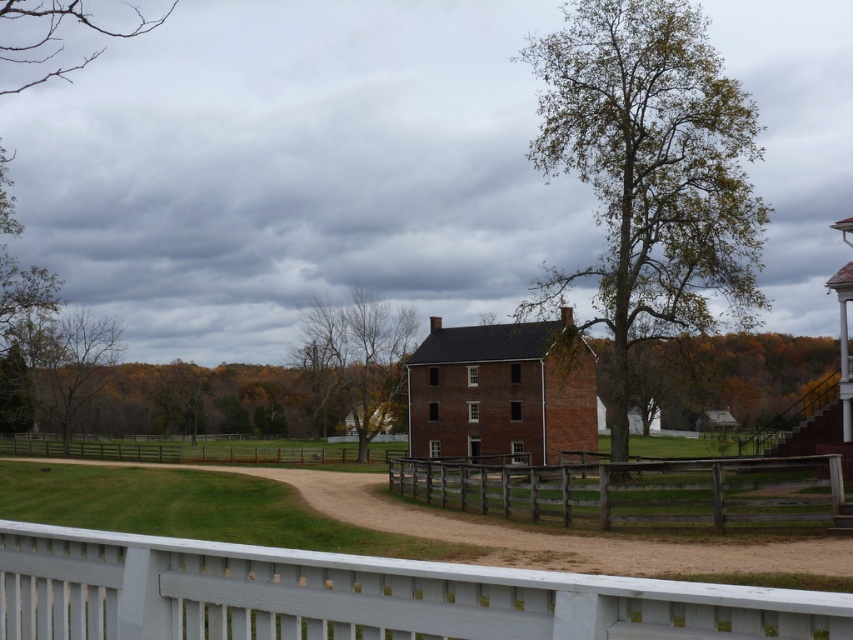
Question: Is the position of green leafy tree at center-right more distant than that of bare branches at upper left?

Choices:
 (A) yes
 (B) no

Answer: (A)

Question: Estimate the real-world distances between objects in this image. Which object is closer to the wooden planks at lower center?

Choices:
 (A) green leafy tree at center-right
 (B) bare branches at upper left
 (C) brown dirt track at center

Answer: (C)

Question: In this image, where is wooden planks at lower center located relative to green leafy tree at center-right?

Choices:
 (A) left
 (B) right

Answer: (A)

Question: Which of these objects is positioned farthest from the brown leafy tree at left?

Choices:
 (A) green leafy tree at center-right
 (B) brown leafy tree at center
 (C) brown dirt track at center

Answer: (C)

Question: Which object appears closest to the camera in this image?

Choices:
 (A) green leafy tree at center
 (B) wooden planks at lower center
 (C) brown leafy tree at left

Answer: (B)

Question: Is brown dirt track at center wider than brown leafy tree at center?

Choices:
 (A) yes
 (B) no

Answer: (A)